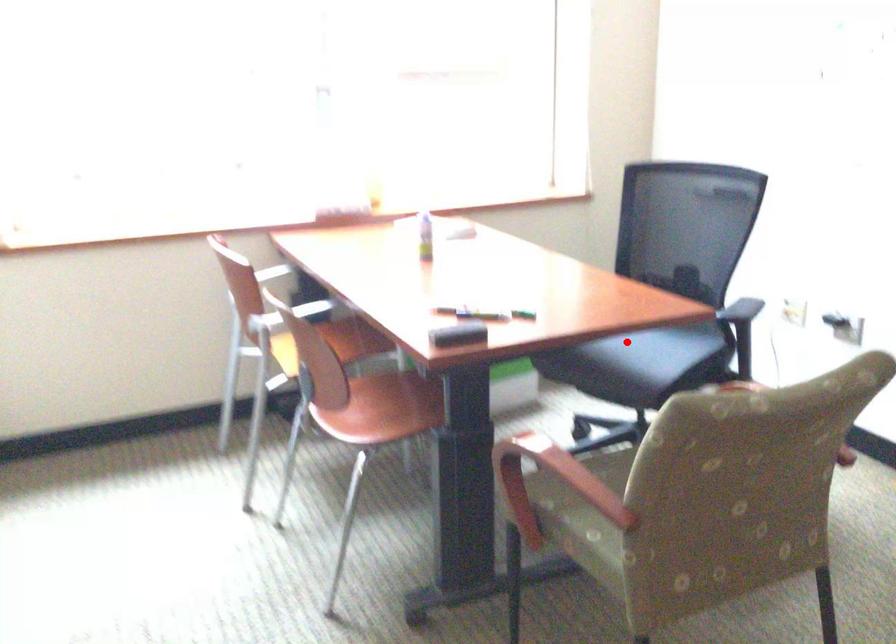
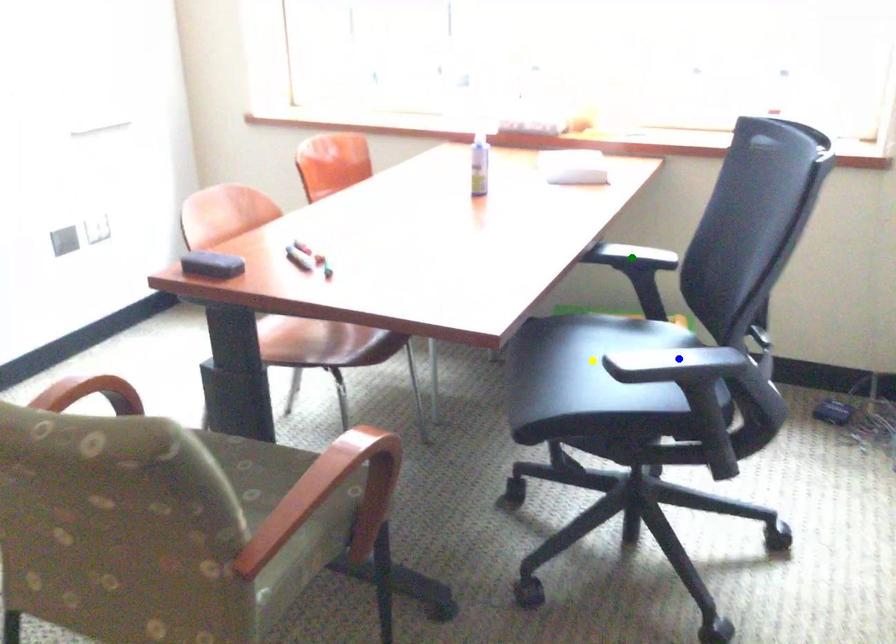
Question: I am providing you with two images of the same scene from different viewpoints. A red point is marked on the first image. You are given multiple points on the second image. Which point in image 2 is actually the same real-world point as the red point in image 1?

Choices:
 (A) blue point
 (B) green point
 (C) yellow point

Answer: (C)